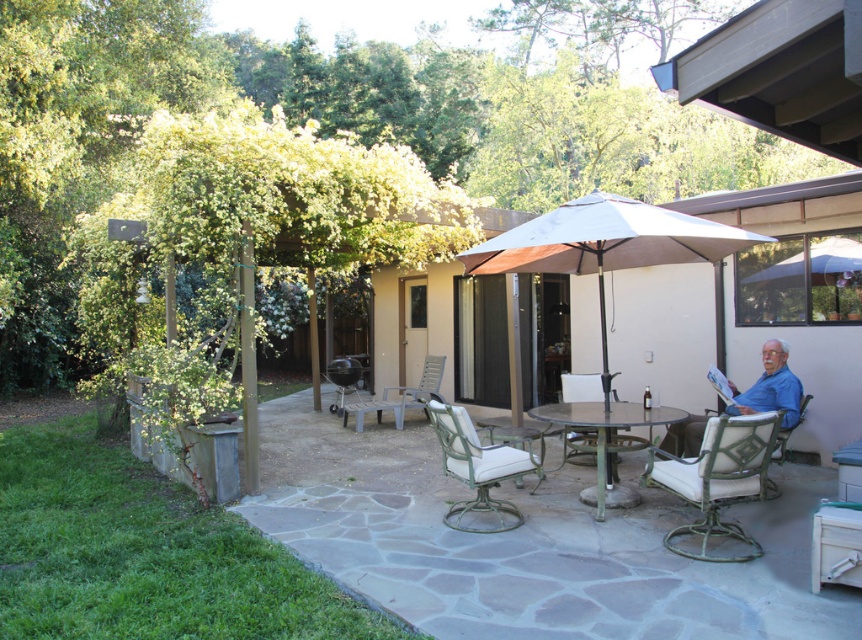
You are a guest at this patio and want to sit in the green metal chair at lower right. You are currently standing next to the green metal chair at center. Which direction should you walk to reach your desired chair?

The green metal chair at lower right is to the right of the green metal chair at center, so you should walk to the right to reach it.

You are planning to host a small gathering and need to know if the plastic patio chair at center can accommodate a large potted plant placed next to the black matte grill at center. Based on their sizes, is there enough space between them?

The plastic patio chair at center is bigger than the black matte grill at center. However, without specific distance information between them, it is unclear if there is enough space for the potted plant. Please check the actual distance between the two objects.